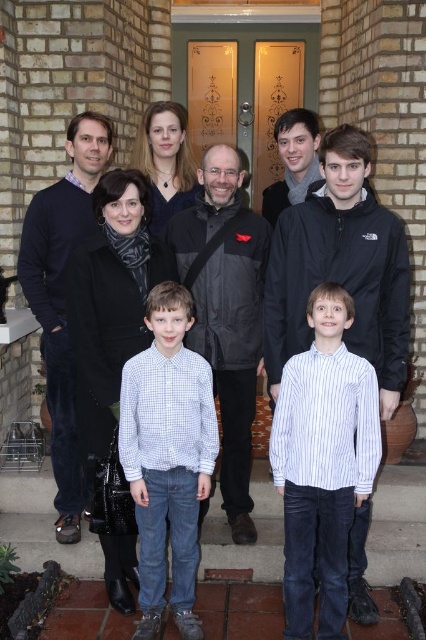
Question: Among these objects, which one is nearest to the camera?

Choices:
 (A) white checkered shirt at center
 (B) white striped shirt at center

Answer: (B)

Question: In this image, where is dark blue sweater at left located relative to matte gray scarf at upper center?

Choices:
 (A) below
 (B) above

Answer: (A)

Question: Can you confirm if black matte jacket at center is positioned below matte gray scarf at upper center?

Choices:
 (A) no
 (B) yes

Answer: (B)

Question: Which of the following is the farthest from the observer?

Choices:
 (A) (204, 472)
 (B) (201, 241)

Answer: (B)

Question: Considering the real-world distances, which object is closest to the matte gray scarf at upper center?

Choices:
 (A) black matte jacket at center
 (B) white checkered shirt at center

Answer: (A)

Question: Does white checkered shirt at center have a larger size compared to black matte jacket at center?

Choices:
 (A) no
 (B) yes

Answer: (A)